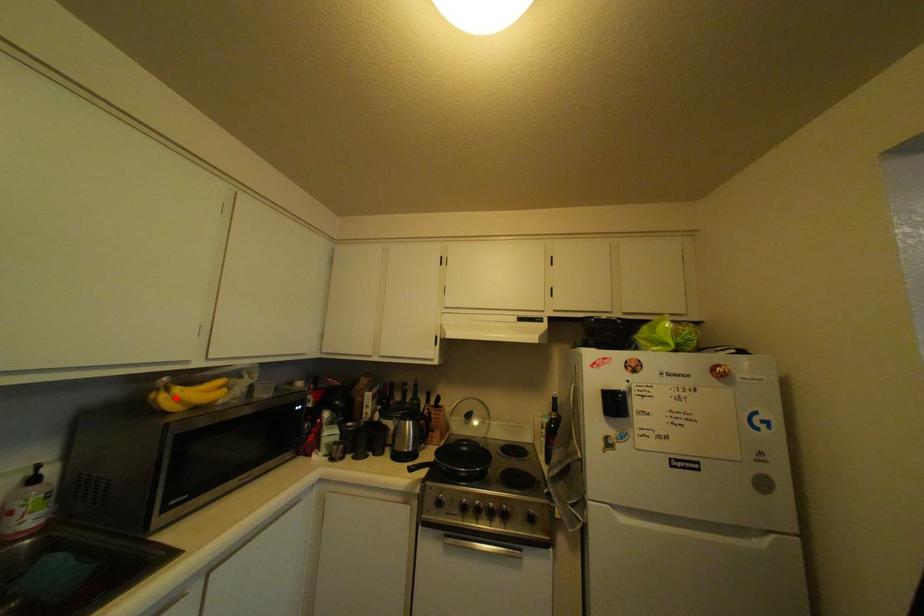
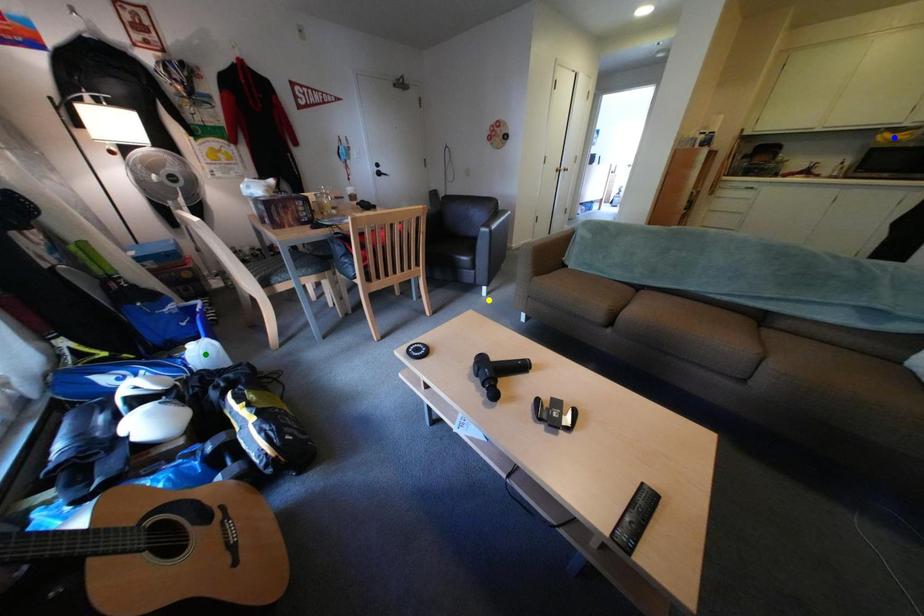
Question: I am providing you with two images of the same scene from different viewpoints. A red point is marked on the first image. You are given multiple points on the second image. Which mark in image 2 goes with the point in image 1?

Choices:
 (A) green point
 (B) yellow point
 (C) blue point

Answer: (C)